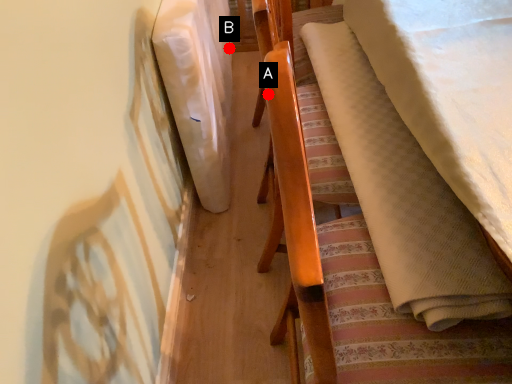
Question: Two points are circled on the image, labeled by A and B beside each circle. Which point is closer to the camera?

Choices:
 (A) A is closer
 (B) B is closer

Answer: (A)